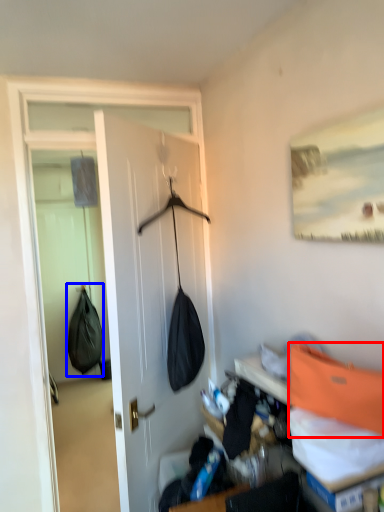
Question: Among these objects, which one is nearest to the camera, shoulder bag (highlighted by a red box) or shoulder bag (highlighted by a blue box)?

Choices:
 (A) shoulder bag
 (B) shoulder bag

Answer: (A)